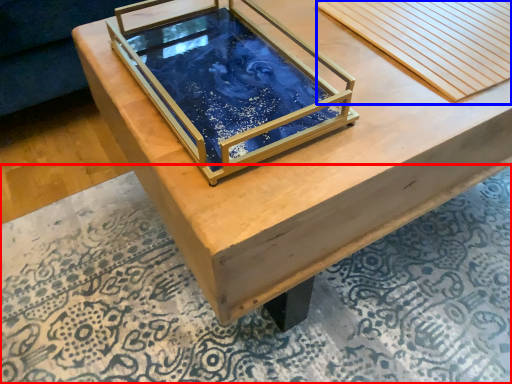
Question: Which object is closer to the camera taking this photo, mat (highlighted by a red box) or plank (highlighted by a blue box)?

Choices:
 (A) mat
 (B) plank

Answer: (A)